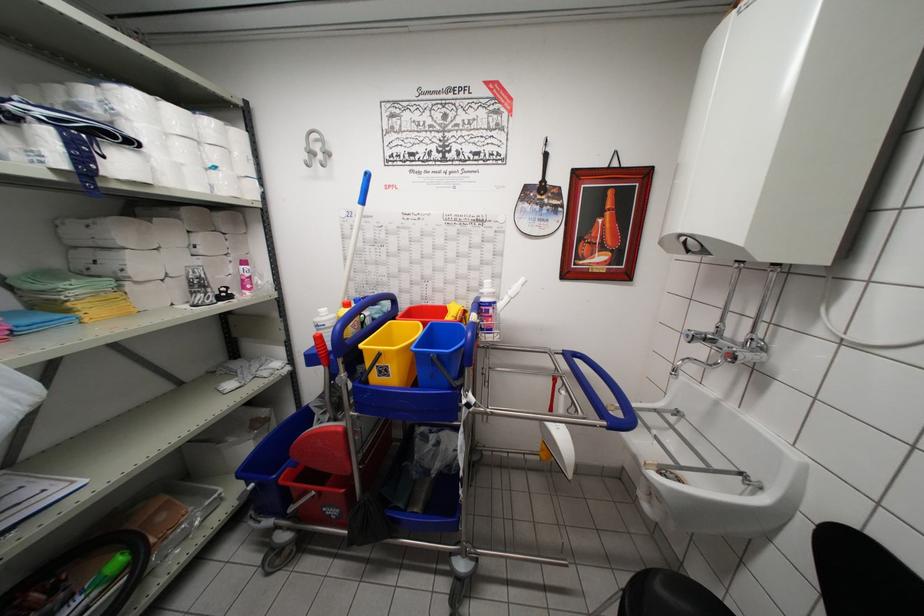
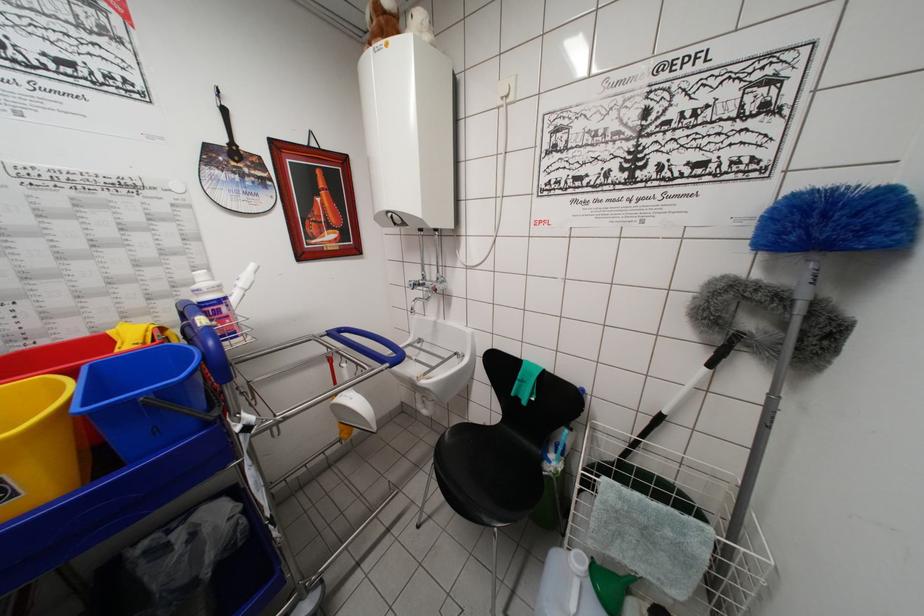
Locate, in the second image, the point that corresponds to the point at 393,381 in the first image.

(20, 500)